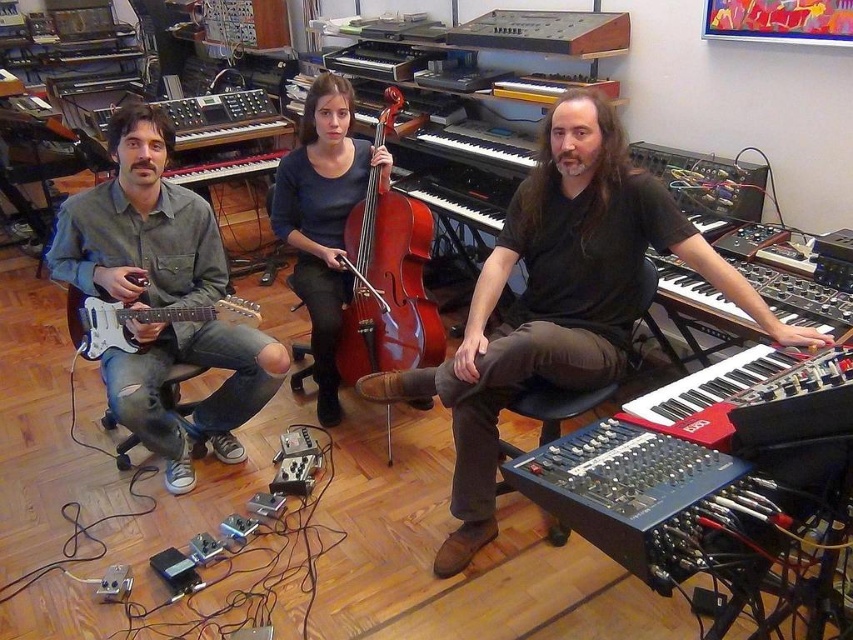
Does matte black guitar at left have a smaller size compared to matte dark blue sweater at center?

No.

Locate an element on the screen. The width and height of the screenshot is (853, 640). matte black guitar at left is located at coordinates tap(138, 227).

Who is taller, black matte keyboard at center or brown matte cello at center?

black matte keyboard at center is taller.

Does point (541, 291) lie in front of point (347, 262)?

Yes, point (541, 291) is in front of point (347, 262).

In order to click on black matte keyboard at center in this screenshot , I will do `click(560, 300)`.

Can you confirm if brown matte cello at center is thinner than matte white electric guitar at left?

Indeed, brown matte cello at center has a lesser width compared to matte white electric guitar at left.

Describe the element at coordinates (387, 285) in the screenshot. I see `brown matte cello at center` at that location.

This screenshot has height=640, width=853. Find the location of `brown matte cello at center`. brown matte cello at center is located at coordinates (387, 285).